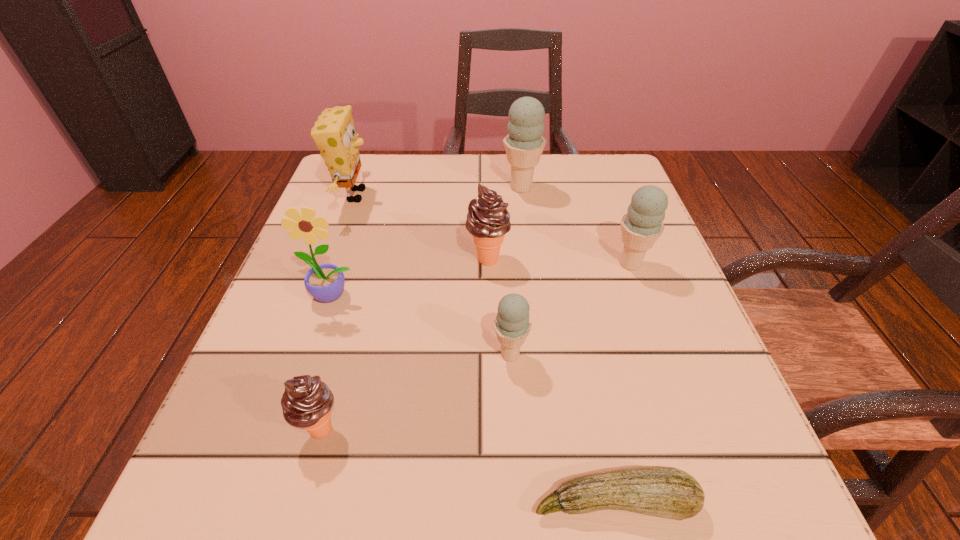
Locate an element on the screen. the nearest icecream is located at coordinates (307, 401).

The width and height of the screenshot is (960, 540). I want to click on the second nearest object, so click(307, 401).

The image size is (960, 540). Identify the location of the shortest object. (666, 492).

This screenshot has width=960, height=540. What are the coordinates of `the nearest object` in the screenshot? It's located at (666, 492).

The width and height of the screenshot is (960, 540). Identify the location of vacant space located on the left of the farthest icecream. (428, 188).

Where is `free space located 0.200m on the front-facing side of the fourth nearest object`? This screenshot has width=960, height=540. free space located 0.200m on the front-facing side of the fourth nearest object is located at coordinates (293, 417).

Locate an element on the screen. vacant space located on the face of the sponge is located at coordinates (493, 195).

Find the location of a particular element. The image size is (960, 540). free location located 0.080m on the left of the bigger chocolate icecream is located at coordinates (424, 259).

This screenshot has width=960, height=540. I want to click on vacant space located 0.140m on the back of the rightmost icecream, so click(611, 210).

Locate an element on the screen. Image resolution: width=960 pixels, height=540 pixels. free point located 0.220m on the left of the smallest blue ice cream is located at coordinates (350, 354).